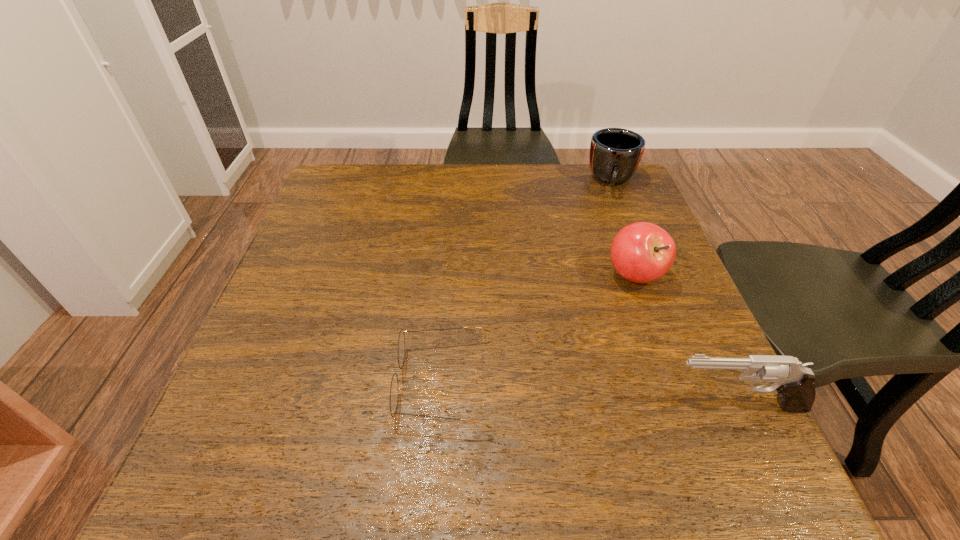
The width and height of the screenshot is (960, 540). Identify the location of the shortest object. (394, 389).

Where is `spectacles`? spectacles is located at coordinates (394, 389).

Find the location of a particular element. The image size is (960, 540). gun is located at coordinates (793, 381).

The image size is (960, 540). What are the coordinates of `apple` in the screenshot? It's located at (641, 252).

Locate an element on the screen. Image resolution: width=960 pixels, height=540 pixels. the farthest object is located at coordinates (615, 153).

Find the location of `free location located 0.240m on the temples of the spectacles`. free location located 0.240m on the temples of the spectacles is located at coordinates (261, 382).

What are the coordinates of `blank space located 0.090m on the temples of the spectacles` in the screenshot? It's located at (346, 382).

Locate an element on the screen. Image resolution: width=960 pixels, height=540 pixels. free space located 0.110m on the temples of the spectacles is located at coordinates (334, 382).

Where is `free region located at the muzzle of the gun`? free region located at the muzzle of the gun is located at coordinates (444, 405).

Identify the location of free space located 0.400m at the muzzle of the gun. (433, 405).